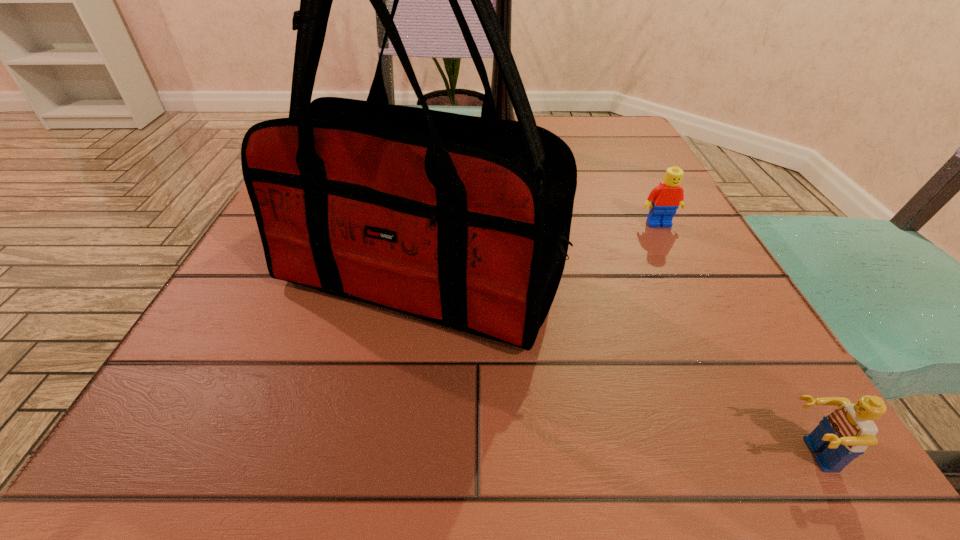
Where is `free region at the near right corner`? This screenshot has height=540, width=960. free region at the near right corner is located at coordinates (764, 462).

I want to click on free spot between the table lamp and the farther Lego, so click(579, 183).

Find the location of a particular element. free space between the nearer Lego and the duffel bag is located at coordinates (615, 367).

In order to click on empty space that is in between the nearer Lego and the table lamp in this screenshot , I will do `click(654, 299)`.

The height and width of the screenshot is (540, 960). I want to click on vacant area that lies between the nearest object and the second tallest object, so click(x=615, y=367).

The width and height of the screenshot is (960, 540). Find the location of `vacant area between the nearer Lego and the farther Lego`. vacant area between the nearer Lego and the farther Lego is located at coordinates (733, 339).

Where is `free point between the tallest object and the farther Lego`? free point between the tallest object and the farther Lego is located at coordinates (579, 183).

Find the location of `free spot between the farther Lego and the table lamp`. free spot between the farther Lego and the table lamp is located at coordinates (579, 183).

Locate an element on the screen. object that is the third closest to the second tallest object is located at coordinates (844, 434).

This screenshot has height=540, width=960. Identify the location of object identified as the closest to the duffel bag. (666, 198).